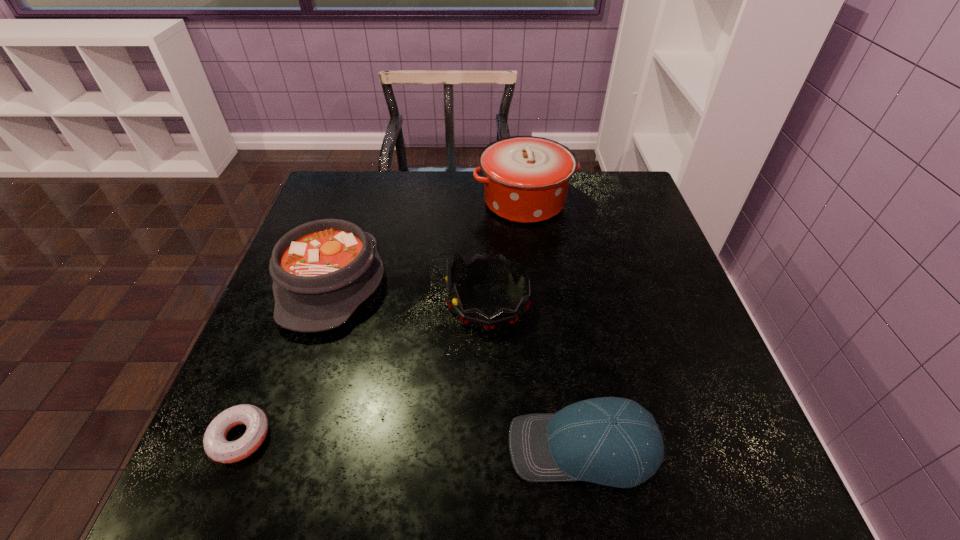
Identify the location of the taller casserole. (526, 178).

Locate an element on the screen. The width and height of the screenshot is (960, 540). the farther casserole is located at coordinates (526, 178).

Where is `tiara`? The height and width of the screenshot is (540, 960). tiara is located at coordinates (478, 265).

You are a GUI agent. You are given a task and a screenshot of the screen. Output one action in this format:
    pyautogui.click(x=<x>, y=<y>)
    Task: Click on the shorter casserole
    The width and height of the screenshot is (960, 540).
    Given the screenshot: What is the action you would take?
    pyautogui.click(x=322, y=270)

Where is `the third tallest object`? The image size is (960, 540). the third tallest object is located at coordinates pos(322,270).

At what (x,y) coordinates should I click in order to perform the action: click on the second shortest object. Please return your answer as a coordinate pair (x, y). This screenshot has height=540, width=960. Looking at the image, I should click on (611, 441).

The height and width of the screenshot is (540, 960). I want to click on the shortest object, so click(216, 446).

Identify the location of vacant point located on the left of the farthest object. (405, 201).

Image resolution: width=960 pixels, height=540 pixels. Identify the location of vacant space located 0.120m at the front of the tiara with jewels. tap(395, 301).

Locate an element on the screen. The image size is (960, 540). vacant space located at the front of the tiara with jewels is located at coordinates coord(299,301).